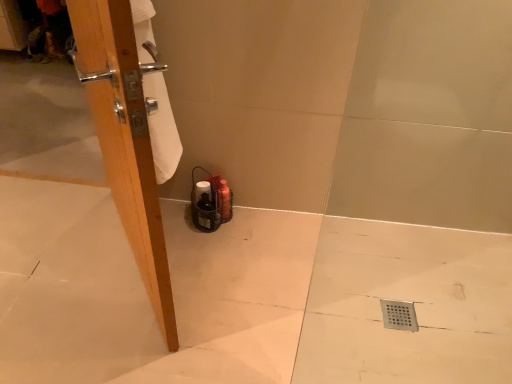
Locate an element on the screen. wooden door at left is located at coordinates (125, 140).

The image size is (512, 384). Describe the element at coordinates (125, 140) in the screenshot. I see `wooden door at left` at that location.

This screenshot has height=384, width=512. I want to click on wooden door at left, so click(125, 140).